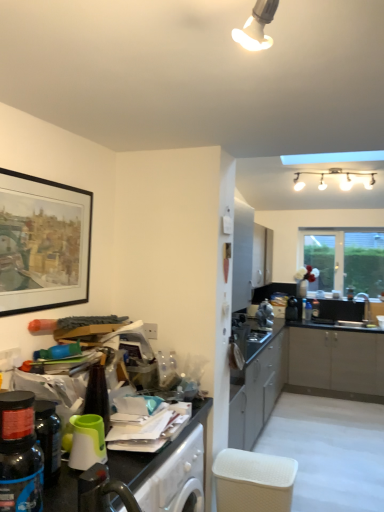
Question: Is white textured basket at lower center shorter than black plastic toaster at center-right, positioned as the 3th appliance in left-to-right order?

Choices:
 (A) no
 (B) yes

Answer: (A)

Question: Does white textured basket at lower center have a lesser width compared to black plastic toaster at center-right, the 3th appliance when ordered from front to back?

Choices:
 (A) no
 (B) yes

Answer: (A)

Question: Can you confirm if white textured basket at lower center is smaller than black plastic toaster at center-right, positioned as the 3th appliance in left-to-right order?

Choices:
 (A) no
 (B) yes

Answer: (A)

Question: From the image's perspective, is white textured basket at lower center located beneath black plastic toaster at center-right, which is the 1th appliance in back-to-front order?

Choices:
 (A) yes
 (B) no

Answer: (A)

Question: From the image's perspective, does white textured basket at lower center appear higher than black plastic toaster at center-right, which is the 1th appliance in back-to-front order?

Choices:
 (A) no
 (B) yes

Answer: (A)

Question: Relative to clear glass window at upper right, is green plastic cup at lower left, arranged as the 1th appliance when viewed from the front, in front or behind?

Choices:
 (A) behind
 (B) front

Answer: (B)

Question: Do you think green plastic cup at lower left, arranged as the 1th appliance when viewed from the front, is within clear glass window at upper right, or outside of it?

Choices:
 (A) inside
 (B) outside

Answer: (B)

Question: Is green plastic cup at lower left, arranged as the 1th appliance when viewed from the front, bigger or smaller than clear glass window at upper right?

Choices:
 (A) big
 (B) small

Answer: (B)

Question: In terms of width, does green plastic cup at lower left, placed as the third appliance when sorted from back to front, look wider or thinner when compared to clear glass window at upper right?

Choices:
 (A) thin
 (B) wide

Answer: (B)

Question: Is satin silver toaster at center-right, the 2th appliance viewed from the front, inside or outside of black plastic toaster at center-right, the 3th appliance when ordered from front to back?

Choices:
 (A) inside
 (B) outside

Answer: (B)

Question: From the image's perspective, is satin silver toaster at center-right, the 2th appliance viewed from the front, above or below black plastic toaster at center-right, which is the 1th appliance in back-to-front order?

Choices:
 (A) below
 (B) above

Answer: (B)

Question: From a real-world perspective, is satin silver toaster at center-right, which is the second appliance from back to front, above or below black plastic toaster at center-right, which is the 1th appliance in back-to-front order?

Choices:
 (A) below
 (B) above

Answer: (B)

Question: In terms of height, does satin silver toaster at center-right, the second appliance positioned from the left, look taller or shorter compared to black plastic toaster at center-right, positioned as the 3th appliance in left-to-right order?

Choices:
 (A) tall
 (B) short

Answer: (A)

Question: From their relative heights in the image, would you say satin silver toaster at center-right, the 2th appliance viewed from the front, is taller or shorter than black matte picture frame at left?

Choices:
 (A) tall
 (B) short

Answer: (B)

Question: In the image, is satin silver toaster at center-right, the second appliance positioned from the left, positioned in front of or behind black matte picture frame at left?

Choices:
 (A) behind
 (B) front

Answer: (A)